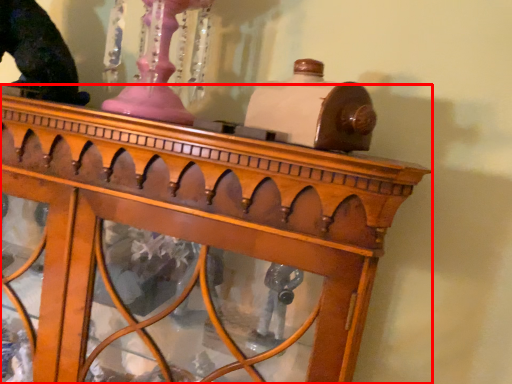
Question: Observing the image, what is the correct spatial positioning of furniture (annotated by the red box) in reference to animal?

Choices:
 (A) right
 (B) left

Answer: (A)